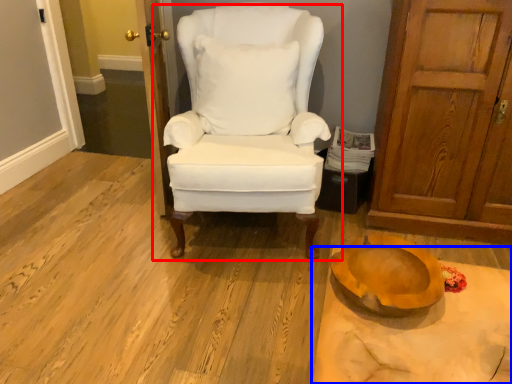
Question: Which object appears farthest to the camera in this image, chair (highlighted by a red box) or table (highlighted by a blue box)?

Choices:
 (A) chair
 (B) table

Answer: (A)